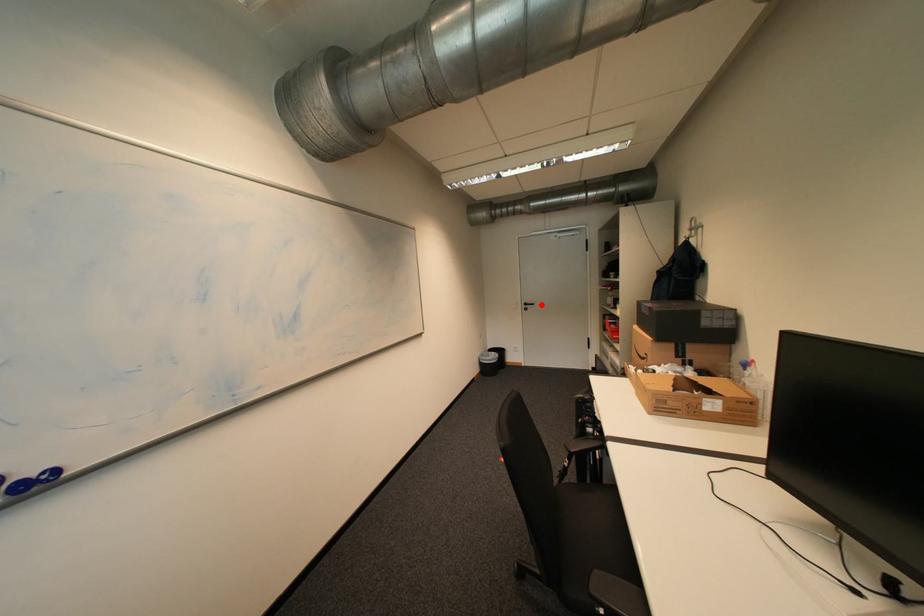
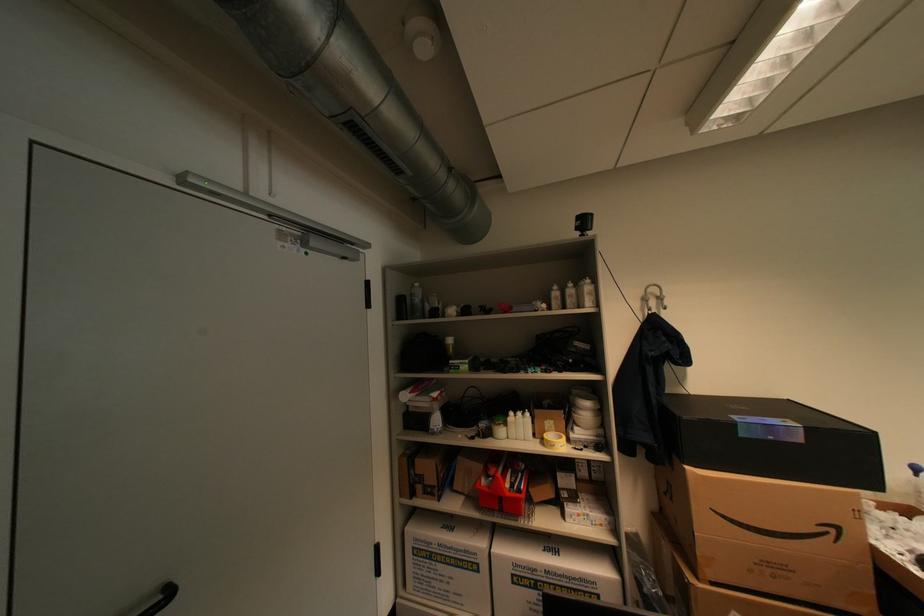
Where in the second image is the point corresponding to the highlighted location from the first image?

(176, 594)